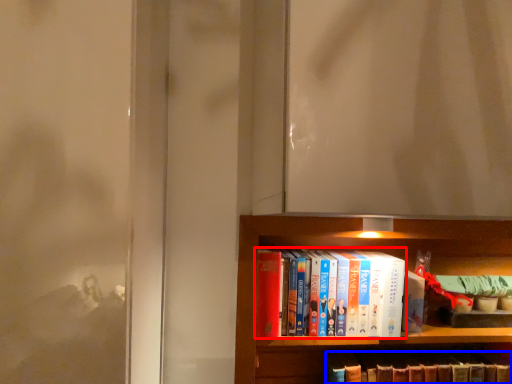
Question: Which object is closer to the camera taking this photo, book (highlighted by a red box) or book (highlighted by a blue box)?

Choices:
 (A) book
 (B) book

Answer: (A)